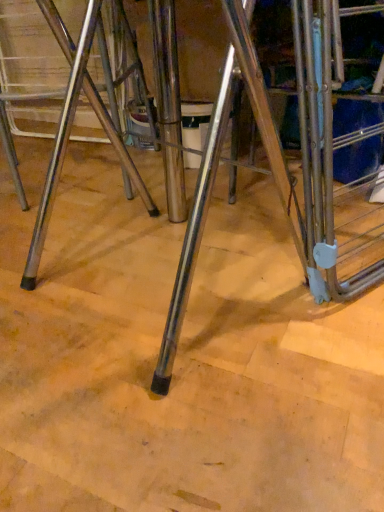
Question: Should I look upward or downward to see silver metallic ladder at center?

Choices:
 (A) up
 (B) down

Answer: (A)